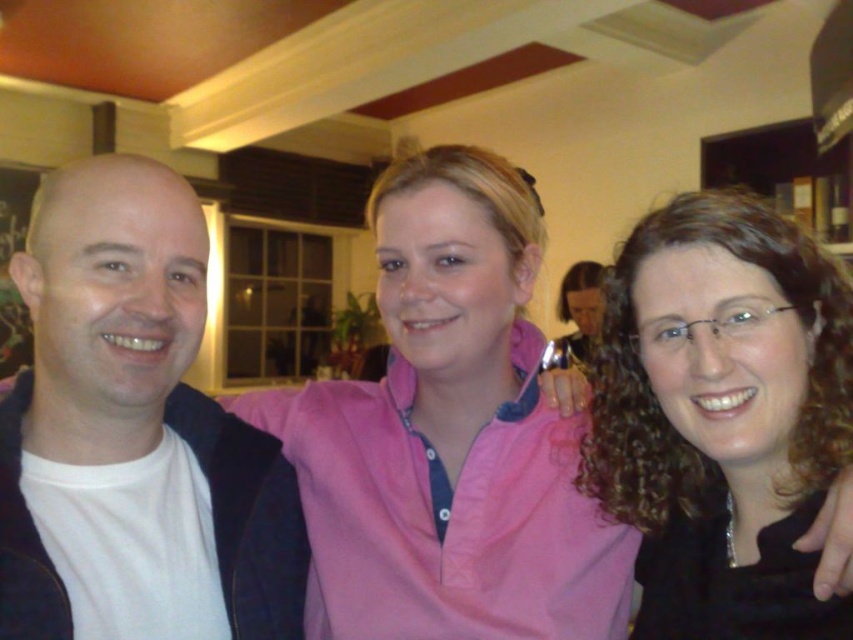
You are a photographer setting up a shot for the three people in the image. You need to ensure that the pink cotton shirt at center and the curly brown hair at center are both visible in the frame. Which object should you prioritize keeping in the frame if you have to choose between them due to limited space?

The pink cotton shirt at center should be prioritized because its width surpasses that of the curly brown hair at center, making it more important to include the wider object in the frame.